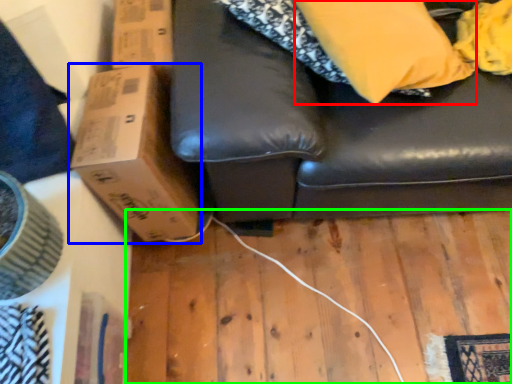
Question: Considering the real-world distances, which object is closest to pillow (highlighted by a red box)? cardboard box (highlighted by a blue box) or plywood (highlighted by a green box).

Choices:
 (A) cardboard box
 (B) plywood

Answer: (A)